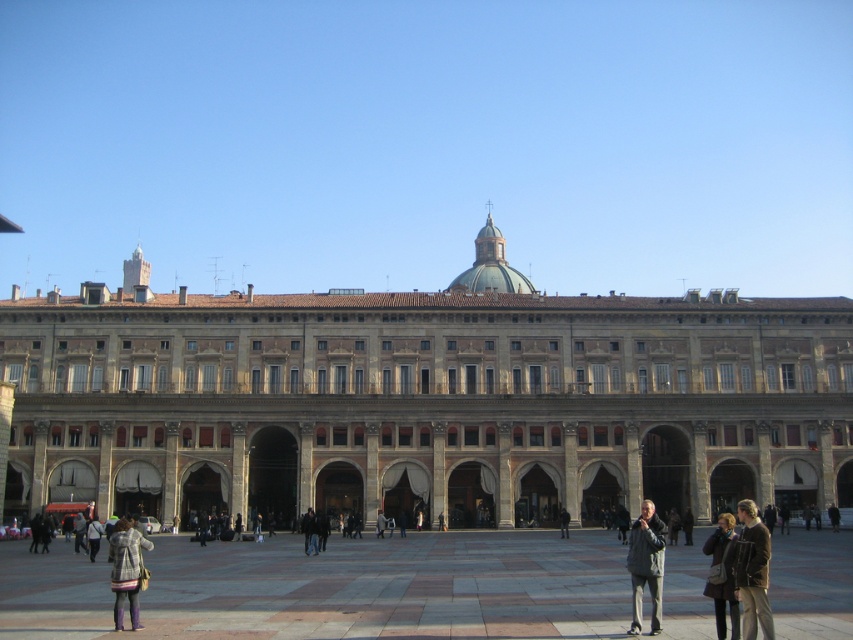
You are standing in the public square looking at the grand building. There are two points marked on the building facade. The first point is at coordinates point [744,579] and the second is at point [706,586]. Which of these two points is closer to you as you face the building?

Point [744,579] is in front of point [706,586], so it is closer to you as you face the building.

You are a fashion designer observing a scene with a leather jacket at lower right and a dark gray wool coat at lower right. Which clothing item is positioned higher on the rack?

The leather jacket at lower right is positioned above the dark gray wool coat at lower right, so it is higher on the rack.

You are standing in the public square and want to take a photo of the brown stone building at center. If you are at the point with coordinates (425, 400), is that the best position to capture the entire building in your camera frame?

The point (425, 400) corresponds to the location of the brown stone building at center, so standing at that exact point would place you right at the building itself, making it impossible to capture the entire structure in the frame.